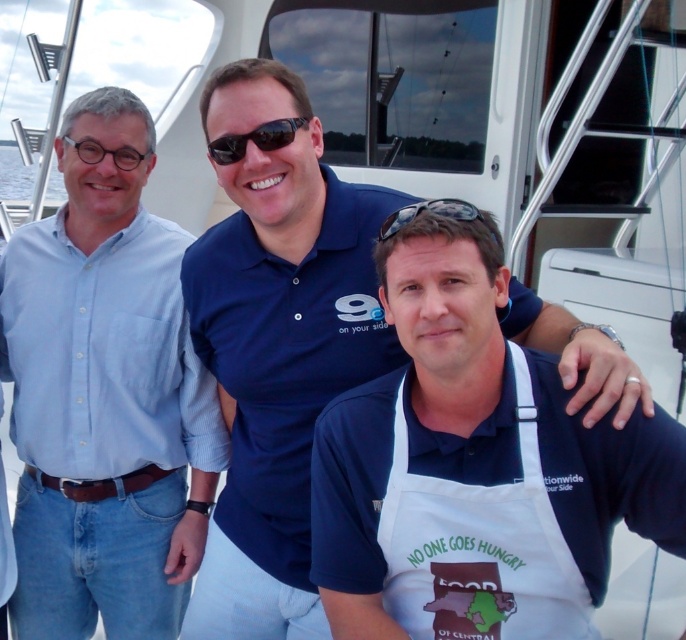
Question: Which of the following is the closest to the observer?

Choices:
 (A) (565, 541)
 (B) (198, 385)

Answer: (A)

Question: Is light blue button-down shirt at left further to camera compared to black reflective sunglasses at center?

Choices:
 (A) no
 (B) yes

Answer: (B)

Question: Does light blue button-down shirt at left appear over white fabric apron at center?

Choices:
 (A) no
 (B) yes

Answer: (B)

Question: Which point is closer to the camera?

Choices:
 (A) white apron at center
 (B) light blue button-down shirt at left

Answer: (A)

Question: Estimate the real-world distances between objects in this image. Which object is closer to the white apron at center?

Choices:
 (A) black plastic sunglasses at center
 (B) white fabric apron at center
 (C) light blue button-down shirt at left

Answer: (B)

Question: Does light blue button-down shirt at left appear on the left side of black reflective sunglasses at center?

Choices:
 (A) no
 (B) yes

Answer: (B)